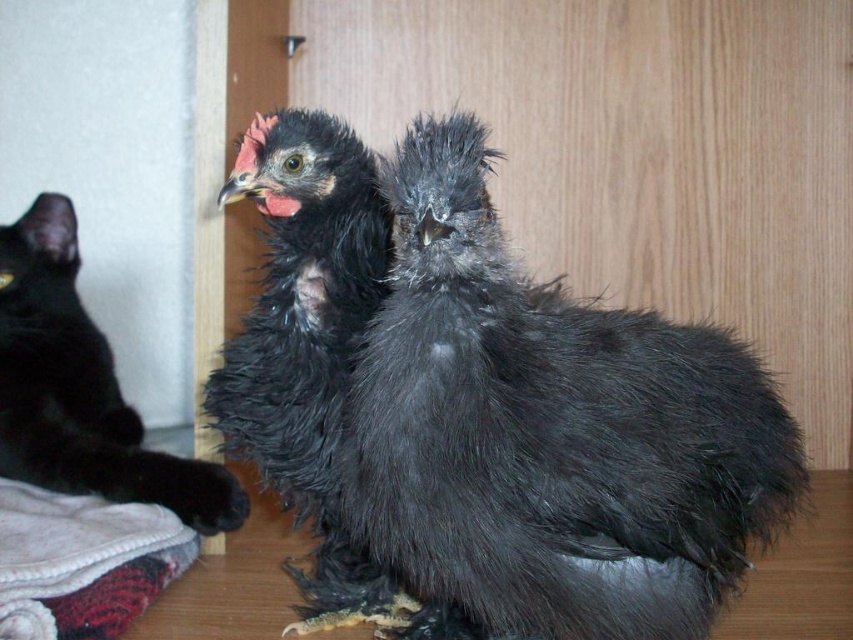
Question: Which point appears farthest from the camera in this image?

Choices:
 (A) (345, 182)
 (B) (589, 419)

Answer: (A)

Question: Is silky black chicken at center thinner than black fur cat at left?

Choices:
 (A) no
 (B) yes

Answer: (A)

Question: Estimate the real-world distances between objects in this image. Which object is farther from the silky black chicken at center?

Choices:
 (A) black fluffy chicken at center
 (B) black fur cat at left

Answer: (B)

Question: Among these points, which one is nearest to the camera?

Choices:
 (A) (300, 163)
 (B) (132, 449)

Answer: (A)

Question: Does silky black chicken at center have a lesser width compared to black fur cat at left?

Choices:
 (A) yes
 (B) no

Answer: (B)

Question: Is silky black chicken at center wider than black fur cat at left?

Choices:
 (A) no
 (B) yes

Answer: (B)